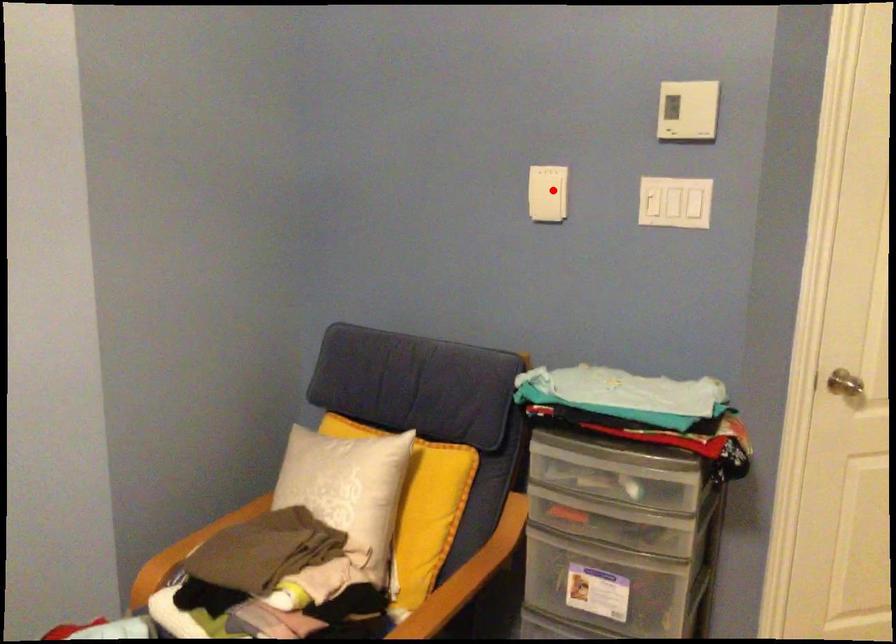
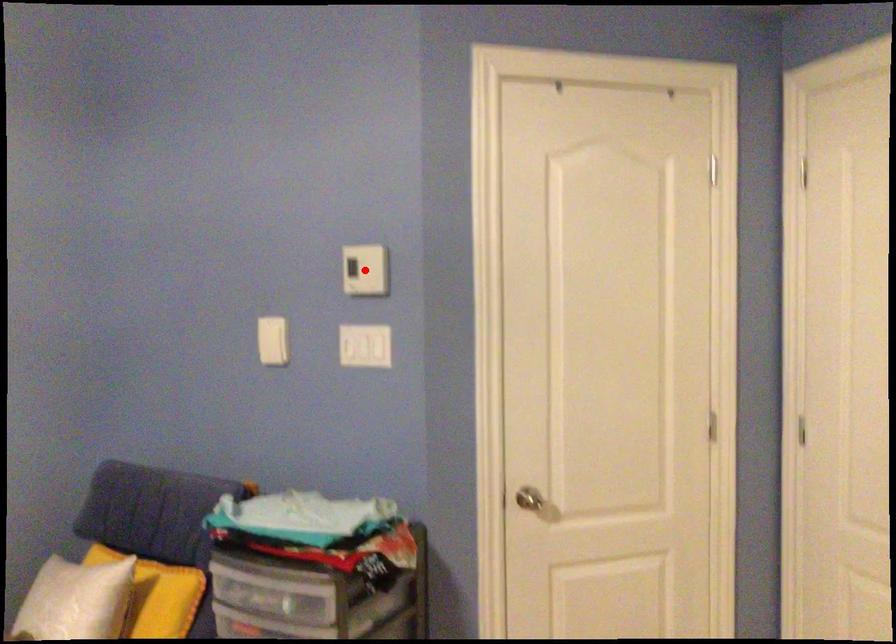
I am providing you with two images of the same scene from different viewpoints. A red point is marked on the first image and another point is marked on the second image. Are the points marked in image1 and image2 representing the same 3D position?

No